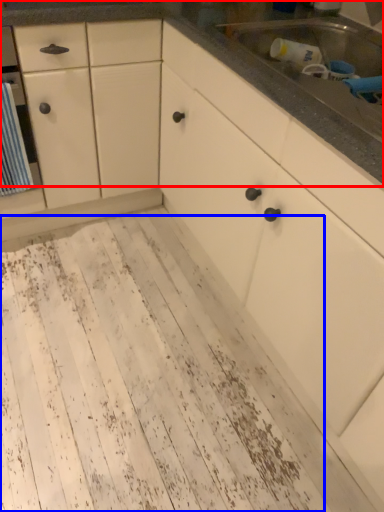
Question: Which object is further to the camera taking this photo, countertop (highlighted by a red box) or mud (highlighted by a blue box)?

Choices:
 (A) countertop
 (B) mud

Answer: (A)